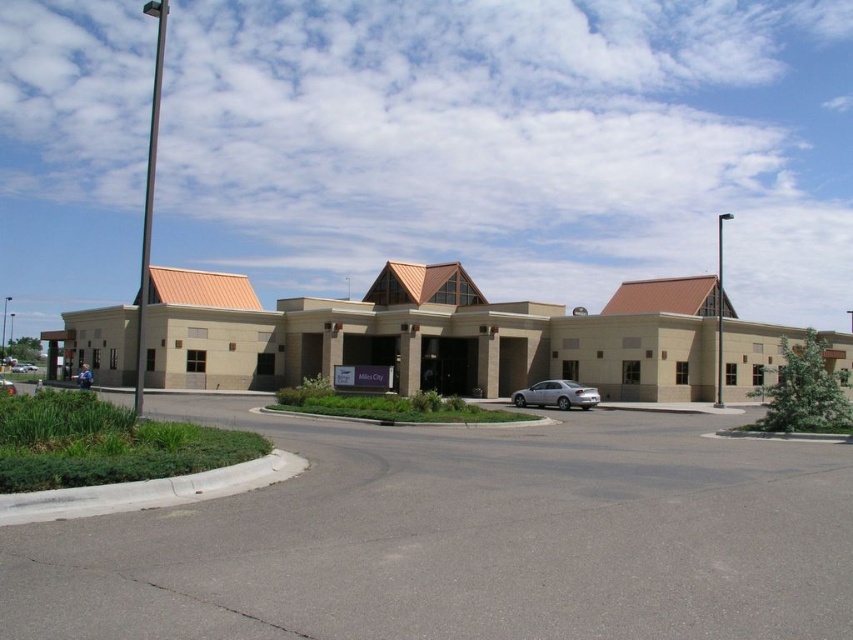
Question: Among these points, which one is farthest from the camera?

Choices:
 (A) (311, 346)
 (B) (532, 403)

Answer: (A)

Question: Which object is the farthest from the beige concrete building at center?

Choices:
 (A) silver metallic sedan at center
 (B) gray asphalt parking lot at center

Answer: (B)

Question: Estimate the real-world distances between objects in this image. Which object is closer to the silver metallic sedan at center?

Choices:
 (A) beige concrete building at center
 (B) gray asphalt parking lot at center

Answer: (A)

Question: Can you confirm if gray asphalt parking lot at center is positioned to the right of silver metallic sedan at center?

Choices:
 (A) no
 (B) yes

Answer: (A)

Question: Can you confirm if beige concrete building at center is smaller than silver metallic sedan at center?

Choices:
 (A) yes
 (B) no

Answer: (B)

Question: Does gray asphalt parking lot at center lie in front of beige concrete building at center?

Choices:
 (A) yes
 (B) no

Answer: (A)